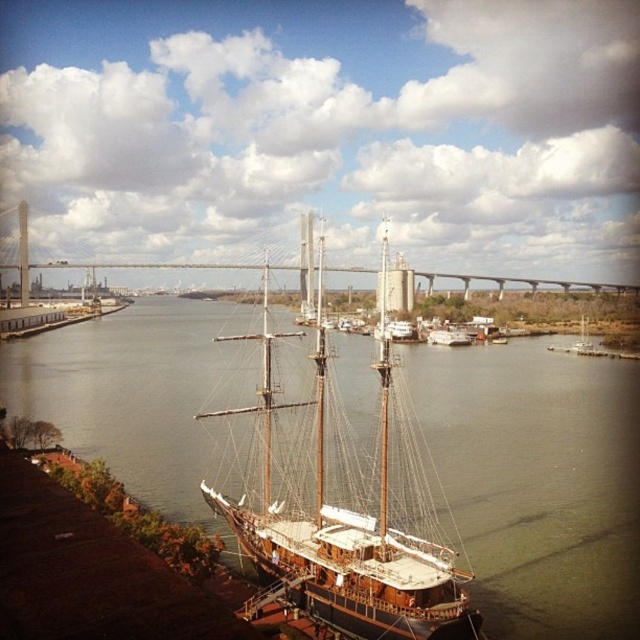
You are a photographer planning to take a photo of the brown wooden ship at center and the wooden sailboat at center from the suspension bridge. Considering their sizes in the frame, which one would appear smaller in your photo?

The brown wooden ship at center would appear smaller in the photo because it occupies less space than the wooden sailboat at center.

You are standing at the riverside and want to reach the point marked at coordinates (x=372, y=593). Given that your walking speed is 3 feet per second, how many seconds will it take you to reach that point?

The point marked at coordinates (x=372, y=593) is 213.74 feet away from the viewer. At a walking speed of 3 feet per second, it would take approximately 213.74 divided by 3, which equals about 71.25 seconds to reach the point.